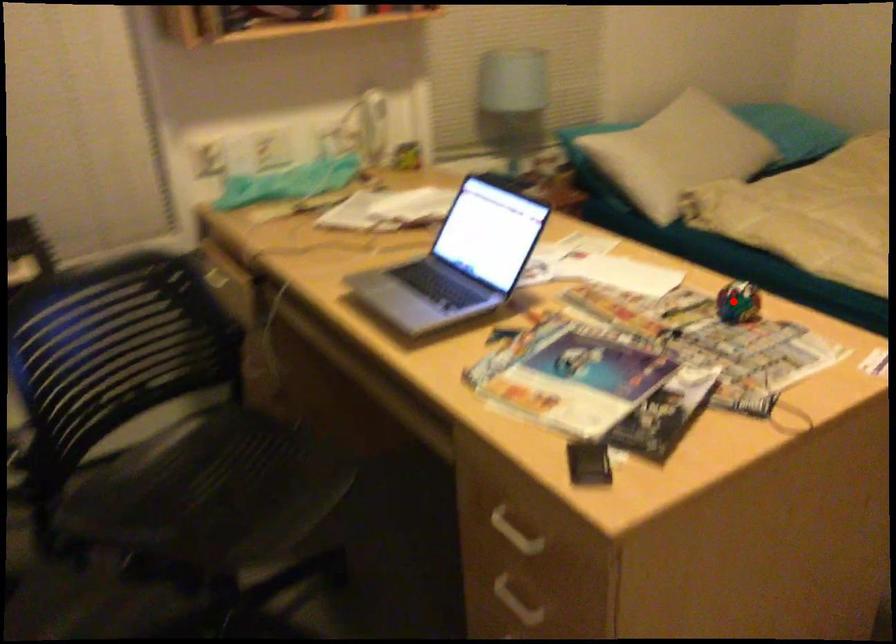
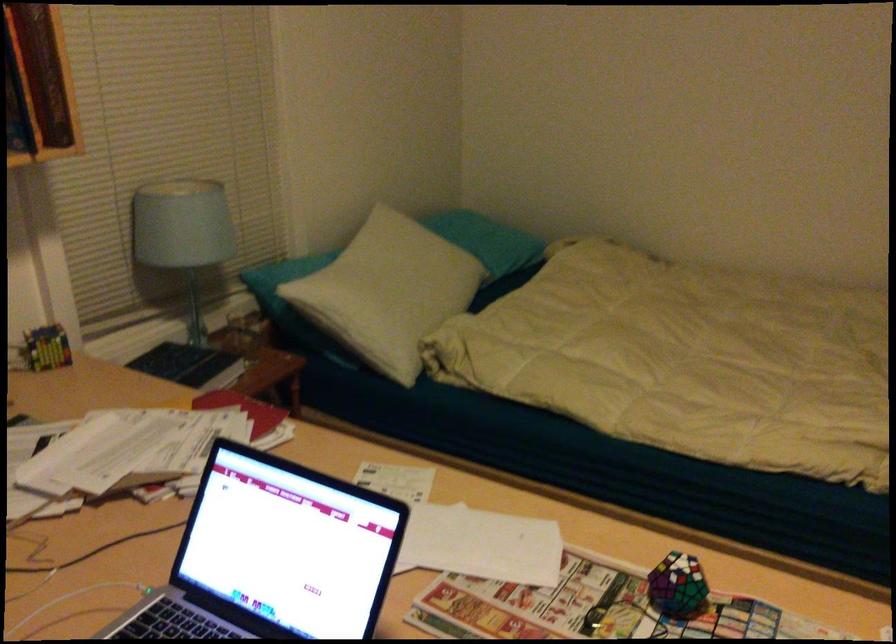
Question: I am providing you with two images of the same scene from different viewpoints. Image1 has a red point marked. In image2, the corresponding 3D location appears at what relative position? Reply with the corresponding letter.

Choices:
 (A) Closer
 (B) Farther

Answer: (A)